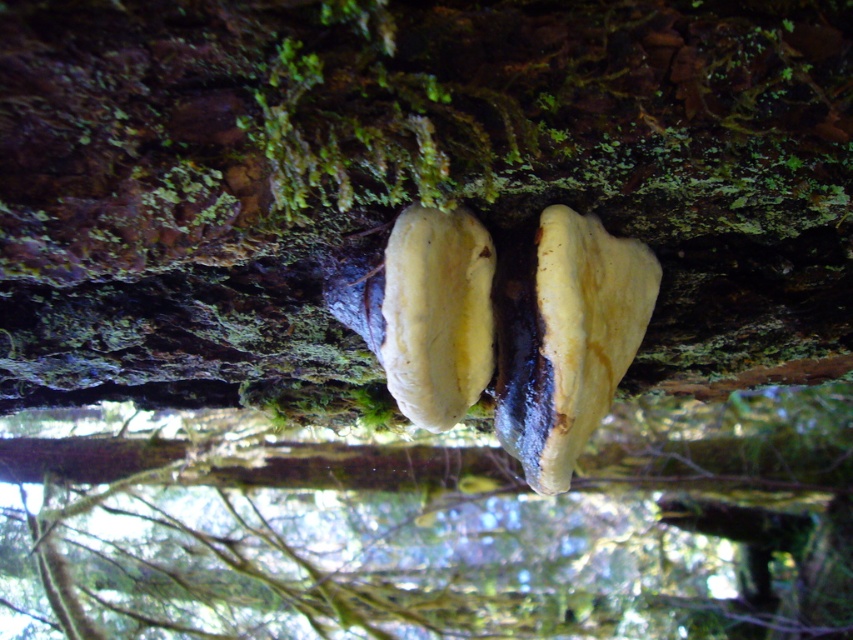
Question: Is yellowish matte fungus at center thinner than yellowish matte mushroom at center?

Choices:
 (A) no
 (B) yes

Answer: (A)

Question: Does yellowish matte fungus at center appear on the right side of yellowish matte mushroom at center?

Choices:
 (A) no
 (B) yes

Answer: (B)

Question: Considering the relative positions of yellowish matte fungus at center and yellowish matte mushroom at center in the image provided, where is yellowish matte fungus at center located with respect to yellowish matte mushroom at center?

Choices:
 (A) above
 (B) below

Answer: (B)

Question: Which point is farther to the camera?

Choices:
 (A) yellowish matte mushroom at center
 (B) yellowish matte fungus at center

Answer: (B)